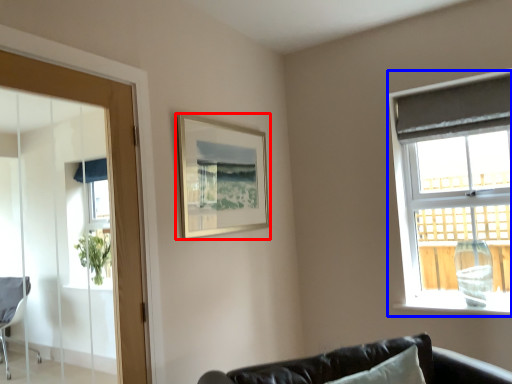
Question: Which point is further to the camera, picture frame (highlighted by a red box) or window (highlighted by a blue box)?

Choices:
 (A) picture frame
 (B) window

Answer: (B)